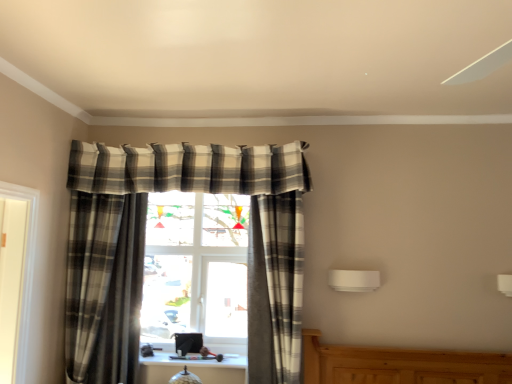
What do you see at coordinates (104, 286) in the screenshot?
I see `plaid fabric curtain at center, the first curtain positioned from the left` at bounding box center [104, 286].

Identify the location of plaid fabric curtain at center, the 2th curtain in the right-to-left sequence. The width and height of the screenshot is (512, 384). (104, 286).

The height and width of the screenshot is (384, 512). What do you see at coordinates (275, 288) in the screenshot?
I see `plaid fabric curtain at right, arranged as the 1th curtain when viewed from the right` at bounding box center [275, 288].

This screenshot has width=512, height=384. I want to click on plaid fabric curtain at right, arranged as the 1th curtain when viewed from the right, so coord(275,288).

What is the approximate height of plaid fabric curtain at right, arranged as the 1th curtain when viewed from the right?

plaid fabric curtain at right, arranged as the 1th curtain when viewed from the right, is 1.19 meters tall.

You are a GUI agent. You are given a task and a screenshot of the screen. Output one action in this format:
    pyautogui.click(x=<x>, y=<y>)
    Task: Click on the plaid fabric curtain at center, the first curtain positioned from the left
    The height and width of the screenshot is (384, 512).
    Given the screenshot: What is the action you would take?
    pyautogui.click(x=104, y=286)

Which is more to the left, plaid fabric curtain at right, arranged as the 1th curtain when viewed from the right, or plaid fabric curtain at center, the first curtain positioned from the left?

plaid fabric curtain at center, the first curtain positioned from the left.

Is plaid fabric curtain at right, arranged as the 1th curtain when viewed from the right, in front of plaid fabric curtain at center, the 2th curtain in the right-to-left sequence?

No, plaid fabric curtain at right, arranged as the 1th curtain when viewed from the right, is behind plaid fabric curtain at center, the 2th curtain in the right-to-left sequence.

Considering the points (274, 211) and (111, 246), which point is behind, point (274, 211) or point (111, 246)?

Point (111, 246)

From the image's perspective, is plaid fabric curtain at right, placed as the second curtain when sorted from left to right, located beneath plaid fabric curtain at center, the first curtain positioned from the left?

Yes, from the image's perspective, plaid fabric curtain at right, placed as the second curtain when sorted from left to right, is below plaid fabric curtain at center, the first curtain positioned from the left.

From a real-world perspective, which object stands above the other?

plaid fabric curtain at center, the 2th curtain in the right-to-left sequence.

Can you confirm if plaid fabric curtain at right, arranged as the 1th curtain when viewed from the right, is thinner than plaid fabric curtain at center, the 2th curtain in the right-to-left sequence?

No, plaid fabric curtain at right, arranged as the 1th curtain when viewed from the right, is not thinner than plaid fabric curtain at center, the 2th curtain in the right-to-left sequence.

Who is shorter, plaid fabric curtain at right, arranged as the 1th curtain when viewed from the right, or plaid fabric curtain at center, the first curtain positioned from the left?

plaid fabric curtain at right, arranged as the 1th curtain when viewed from the right.

In terms of size, does plaid fabric curtain at right, arranged as the 1th curtain when viewed from the right, appear bigger or smaller than plaid fabric curtain at center, the 2th curtain in the right-to-left sequence?

Considering their sizes, plaid fabric curtain at right, arranged as the 1th curtain when viewed from the right, takes up more space than plaid fabric curtain at center, the 2th curtain in the right-to-left sequence.

Would you say plaid fabric curtain at right, placed as the second curtain when sorted from left to right, is outside plaid fabric curtain at center, the first curtain positioned from the left?

plaid fabric curtain at right, placed as the second curtain when sorted from left to right, lies outside plaid fabric curtain at center, the first curtain positioned from the left,'s area.

Is plaid fabric curtain at center, the 2th curtain in the right-to-left sequence, at the back of plaid fabric curtain at right, arranged as the 1th curtain when viewed from the right?

plaid fabric curtain at right, arranged as the 1th curtain when viewed from the right, is not turned away from plaid fabric curtain at center, the 2th curtain in the right-to-left sequence.

How different are the orientations of plaid fabric curtain at right, placed as the second curtain when sorted from left to right, and plaid fabric curtain at center, the first curtain positioned from the left, in degrees?

They differ by 1.59 degrees in their facing directions.

How distant is plaid fabric curtain at right, arranged as the 1th curtain when viewed from the right, from plaid fabric curtain at center, the 2th curtain in the right-to-left sequence?

The distance of plaid fabric curtain at right, arranged as the 1th curtain when viewed from the right, from plaid fabric curtain at center, the 2th curtain in the right-to-left sequence, is 34.68 inches.

Image resolution: width=512 pixels, height=384 pixels. I want to click on curtain directly beneath the plaid fabric curtain at center, the 2th curtain in the right-to-left sequence (from a real-world perspective), so click(x=275, y=288).

Which object is positioned more to the left, plaid fabric curtain at center, the first curtain positioned from the left, or plaid fabric curtain at right, placed as the second curtain when sorted from left to right?

From the viewer's perspective, plaid fabric curtain at center, the first curtain positioned from the left, appears more on the left side.

Relative to plaid fabric curtain at right, arranged as the 1th curtain when viewed from the right, is plaid fabric curtain at center, the 2th curtain in the right-to-left sequence, in front or behind?

Clearly, plaid fabric curtain at center, the 2th curtain in the right-to-left sequence, is in front of plaid fabric curtain at right, arranged as the 1th curtain when viewed from the right.

Between point (135, 351) and point (290, 381), which one is positioned in front?

Positioned in front is point (290, 381).

From the image's perspective, would you say plaid fabric curtain at center, the 2th curtain in the right-to-left sequence, is shown under plaid fabric curtain at right, arranged as the 1th curtain when viewed from the right?

No.

From a real-world perspective, between plaid fabric curtain at center, the 2th curtain in the right-to-left sequence, and plaid fabric curtain at right, arranged as the 1th curtain when viewed from the right, who is vertically lower?

plaid fabric curtain at right, arranged as the 1th curtain when viewed from the right.

Is plaid fabric curtain at center, the first curtain positioned from the left, wider than plaid fabric curtain at right, placed as the second curtain when sorted from left to right?

Incorrect, the width of plaid fabric curtain at center, the first curtain positioned from the left, does not surpass that of plaid fabric curtain at right, placed as the second curtain when sorted from left to right.

Which of these two, plaid fabric curtain at center, the first curtain positioned from the left, or plaid fabric curtain at right, arranged as the 1th curtain when viewed from the right, stands shorter?

Standing shorter between the two is plaid fabric curtain at right, arranged as the 1th curtain when viewed from the right.

Considering the sizes of plaid fabric curtain at center, the 2th curtain in the right-to-left sequence, and plaid fabric curtain at right, placed as the second curtain when sorted from left to right, in the image, is plaid fabric curtain at center, the 2th curtain in the right-to-left sequence, bigger or smaller than plaid fabric curtain at right, placed as the second curtain when sorted from left to right,?

Clearly, plaid fabric curtain at center, the 2th curtain in the right-to-left sequence, is smaller in size than plaid fabric curtain at right, placed as the second curtain when sorted from left to right.

Would you say plaid fabric curtain at center, the 2th curtain in the right-to-left sequence, contains plaid fabric curtain at right, arranged as the 1th curtain when viewed from the right?

No, plaid fabric curtain at right, arranged as the 1th curtain when viewed from the right, is not a part of plaid fabric curtain at center, the 2th curtain in the right-to-left sequence.

Is plaid fabric curtain at center, the first curtain positioned from the left, far from plaid fabric curtain at right, arranged as the 1th curtain when viewed from the right?

No, plaid fabric curtain at center, the first curtain positioned from the left, is not far away from plaid fabric curtain at right, arranged as the 1th curtain when viewed from the right.

Is plaid fabric curtain at center, the first curtain positioned from the left, positioned with its back to plaid fabric curtain at right, placed as the second curtain when sorted from left to right?

No.

What's the angular difference between plaid fabric curtain at center, the 2th curtain in the right-to-left sequence, and plaid fabric curtain at right, arranged as the 1th curtain when viewed from the right,'s facing directions?

The angular difference between plaid fabric curtain at center, the 2th curtain in the right-to-left sequence, and plaid fabric curtain at right, arranged as the 1th curtain when viewed from the right, is 1.59 degrees.

You are a GUI agent. You are given a task and a screenshot of the screen. Output one action in this format:
    pyautogui.click(x=<x>, y=<y>)
    Task: Click on the curtain to the left of plaid fabric curtain at right, arranged as the 1th curtain when viewed from the right
    
    Given the screenshot: What is the action you would take?
    pyautogui.click(x=104, y=286)

Locate an element on the screen. Image resolution: width=512 pixels, height=384 pixels. curtain above the plaid fabric curtain at right, placed as the second curtain when sorted from left to right (from the image's perspective) is located at coordinates pyautogui.click(x=104, y=286).

Locate an element on the screen. curtain lying on the left of plaid fabric curtain at right, placed as the second curtain when sorted from left to right is located at coordinates (104, 286).